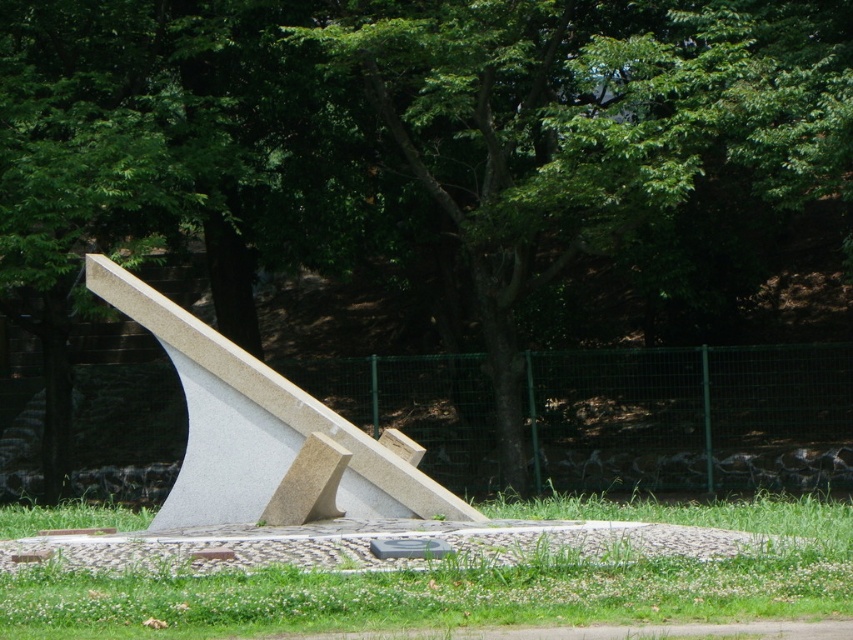
Is point (666, 584) positioned before point (187, 349)?

Yes, it is.

Find the location of a particular element. The width and height of the screenshot is (853, 640). green grass at center is located at coordinates (471, 582).